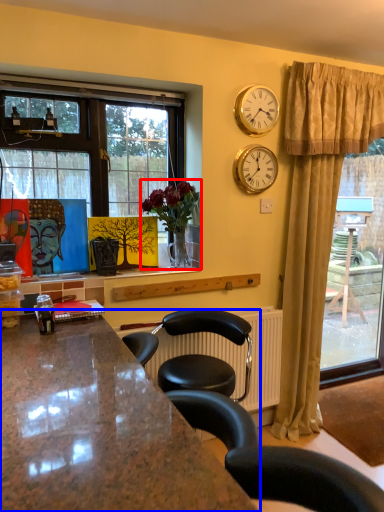
Question: Which of the following is the closest to the observer, houseplant (highlighted by a red box) or countertop (highlighted by a blue box)?

Choices:
 (A) houseplant
 (B) countertop

Answer: (B)